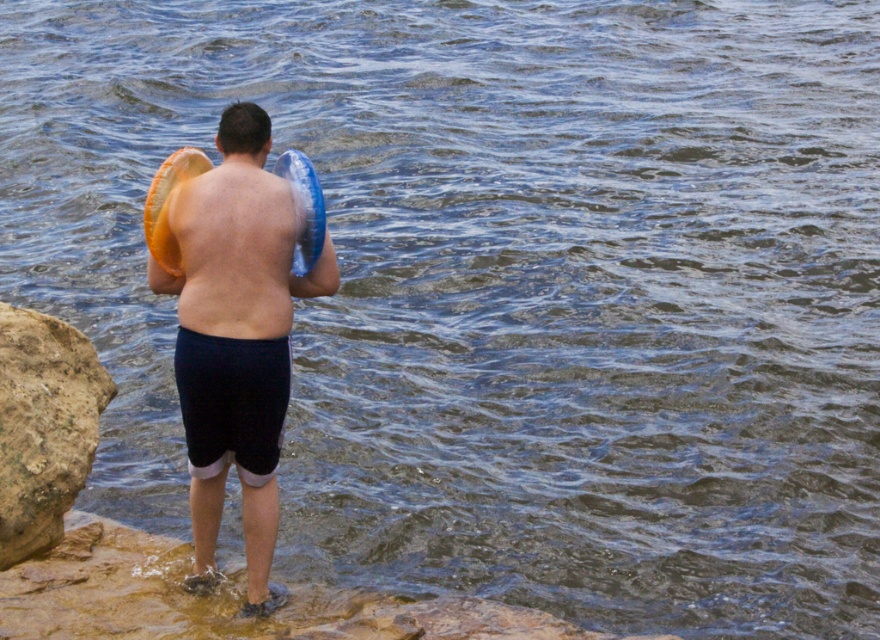
Question: Observing the image, what is the correct spatial positioning of matte orange frisbee at center in reference to matte skin at center?

Choices:
 (A) left
 (B) right

Answer: (B)

Question: Is matte orange frisbee at center below matte skin at center?

Choices:
 (A) yes
 (B) no

Answer: (A)

Question: Which of the following is the farthest from the observer?

Choices:
 (A) (221, 173)
 (B) (64, 440)

Answer: (B)

Question: Is brown rough rock at lower left to the right of matte skin at center from the viewer's perspective?

Choices:
 (A) no
 (B) yes

Answer: (A)

Question: Among these objects, which one is farthest from the camera?

Choices:
 (A) brown rough rock at lower left
 (B) matte orange frisbee at center
 (C) matte skin at center

Answer: (A)

Question: Which object appears farthest from the camera in this image?

Choices:
 (A) brown rough rock at lower left
 (B) matte skin at center
 (C) matte orange frisbee at center

Answer: (A)